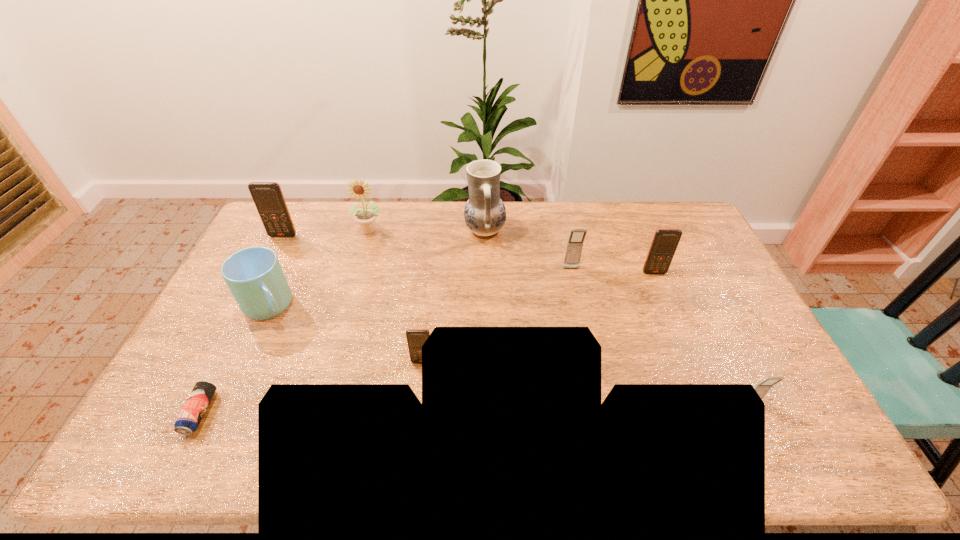
The height and width of the screenshot is (540, 960). I want to click on cellular telephone present at the left edge, so click(x=268, y=197).

Identify the location of mug at the left edge. This screenshot has width=960, height=540. (254, 275).

Locate an element on the screen. The height and width of the screenshot is (540, 960). beer can positioned at the left edge is located at coordinates (198, 401).

Find the location of a particular element. The image size is (960, 540). object at the right edge is located at coordinates (763, 387).

Where is `object that is positioned at the far left corner`? The height and width of the screenshot is (540, 960). object that is positioned at the far left corner is located at coordinates (268, 197).

Where is `object located in the near left corner section of the desktop`? Image resolution: width=960 pixels, height=540 pixels. object located in the near left corner section of the desktop is located at coordinates (198, 401).

Locate an element on the screen. free space at the far edge of the desktop is located at coordinates (607, 210).

The height and width of the screenshot is (540, 960). In order to click on blank space at the near edge of the desktop in this screenshot , I will do `click(291, 438)`.

The width and height of the screenshot is (960, 540). I want to click on vacant space at the right edge of the desktop, so click(x=696, y=308).

What are the coordinates of `vacant space at the far left corner of the desktop` in the screenshot? It's located at (309, 217).